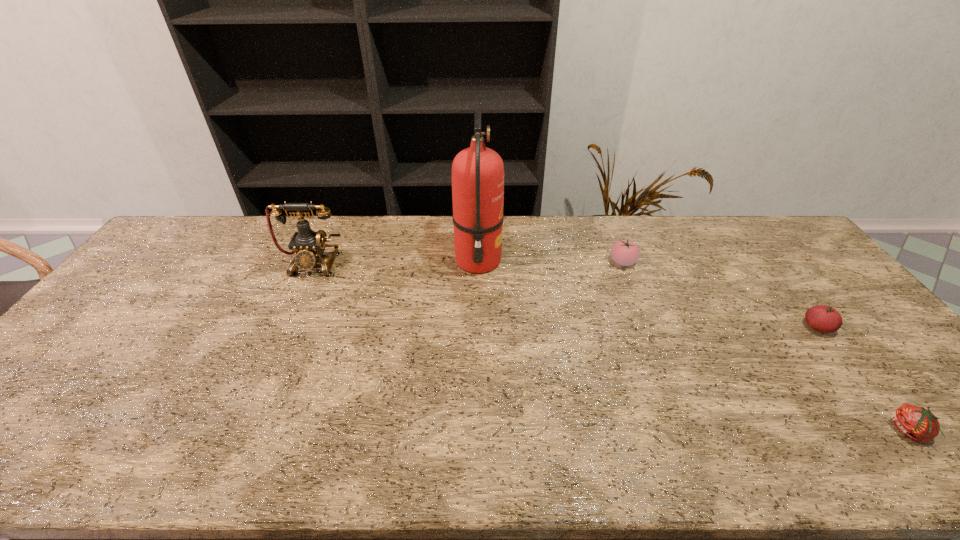
Where is `vacant point that satisfies the following two spatial constraints: 1. on the back side of the nearest tomato; 2. on the side of the second object from left to right with the nozzle and handle`? vacant point that satisfies the following two spatial constraints: 1. on the back side of the nearest tomato; 2. on the side of the second object from left to right with the nozzle and handle is located at coordinates (774, 261).

Locate an element on the screen. This screenshot has width=960, height=540. free space that satisfies the following two spatial constraints: 1. on the front of the second tallest object, featuring the rotary dial; 2. on the right side of the second nearest tomato is located at coordinates (284, 327).